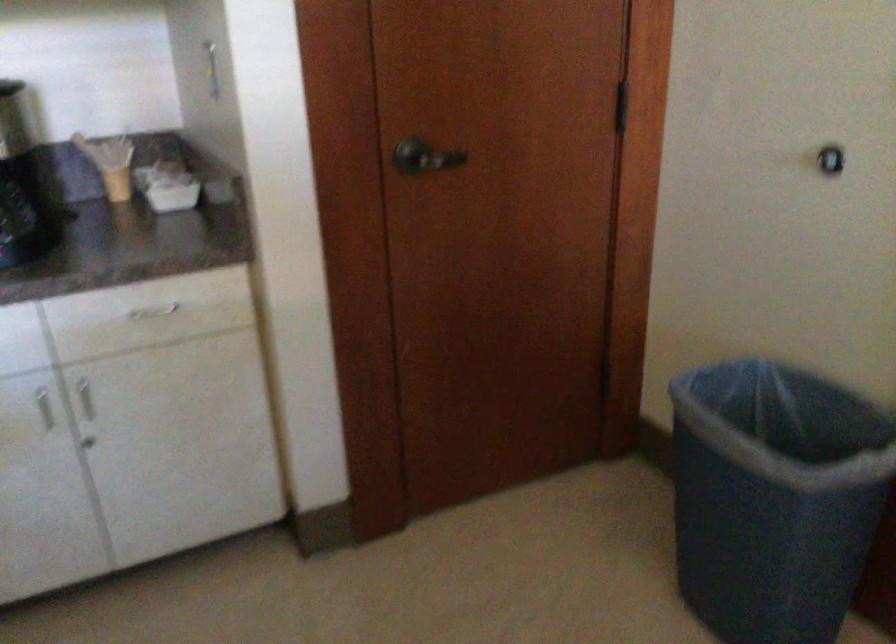
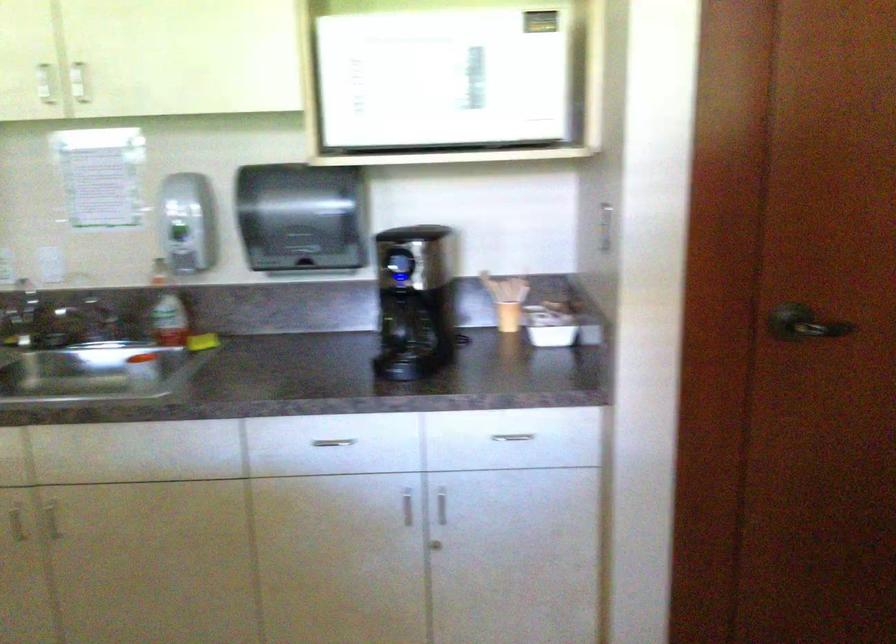
Locate, in the second image, the point that corresponds to point 428,160 in the first image.

(803, 323)